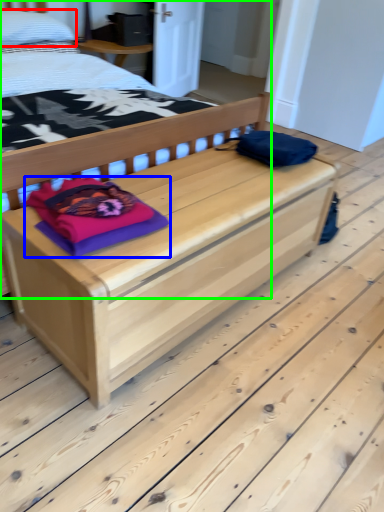
Question: Which object is the closest to the pillow (highlighted by a red box)? Choose among these: material (highlighted by a blue box) or bed (highlighted by a green box).

Choices:
 (A) material
 (B) bed

Answer: (B)